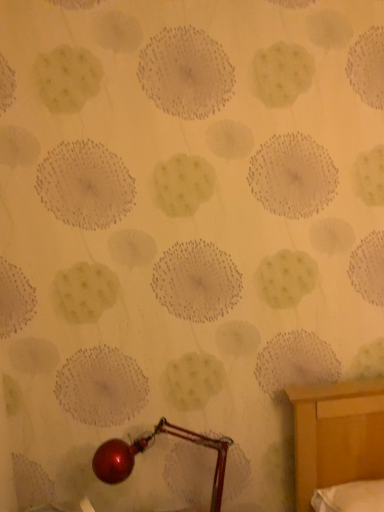
Find the location of a particular element. The height and width of the screenshot is (512, 384). shiny red bulb at lower left is located at coordinates (144, 450).

Describe the element at coordinates (144, 450) in the screenshot. I see `shiny red bulb at lower left` at that location.

Identify the location of shiny red bulb at lower left. (144, 450).